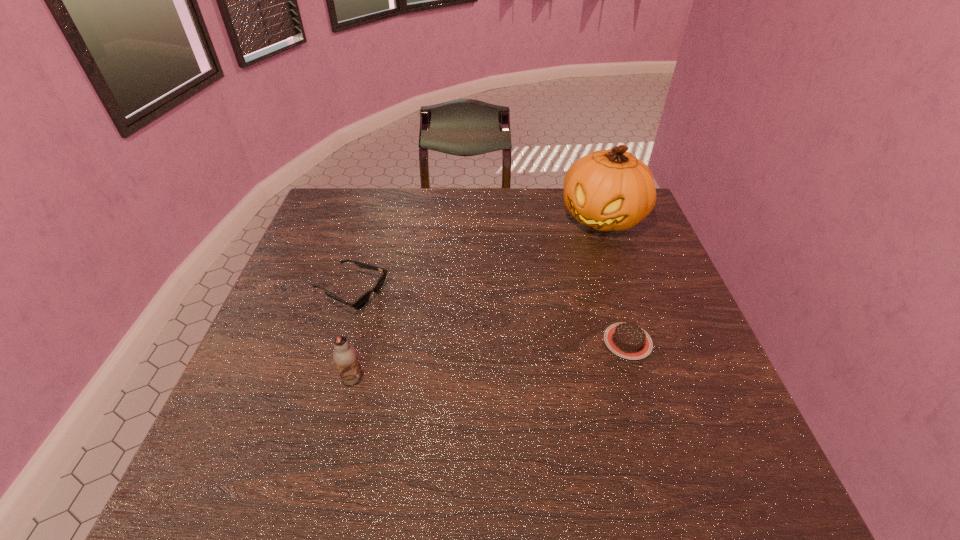
Find the location of a particular element. vacant space on the desktop that is between the third shortest object and the second nearest object and is positioned on the front-facing side of the sunglasses is located at coordinates (512, 357).

The image size is (960, 540). In order to click on free space on the desktop that is between the second tallest object and the second nearest object and is positioned on the front face of the pumpkin in this screenshot , I will do `click(506, 357)`.